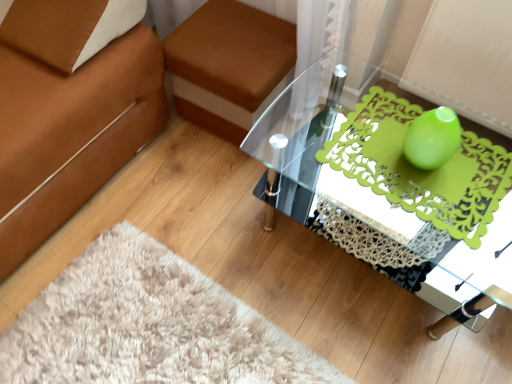
Question: Does brown fabric footrest at upper center lie in front of transparent glass table at center?

Choices:
 (A) no
 (B) yes

Answer: (A)

Question: Is the position of brown fabric footrest at upper center more distant than that of transparent glass table at center?

Choices:
 (A) no
 (B) yes

Answer: (B)

Question: From a real-world perspective, is brown fabric footrest at upper center beneath transparent glass table at center?

Choices:
 (A) yes
 (B) no

Answer: (A)

Question: Considering the relative sizes of brown fabric footrest at upper center and transparent glass table at center in the image provided, is brown fabric footrest at upper center bigger than transparent glass table at center?

Choices:
 (A) no
 (B) yes

Answer: (A)

Question: Does brown fabric footrest at upper center have a lesser height compared to transparent glass table at center?

Choices:
 (A) no
 (B) yes

Answer: (B)

Question: Based on their positions, is brown fabric footrest at upper center located to the left or right of transparent glass table at center?

Choices:
 (A) right
 (B) left

Answer: (B)

Question: Is point (290, 26) positioned closer to the camera than point (400, 256)?

Choices:
 (A) closer
 (B) farther

Answer: (B)

Question: Which is correct: brown fabric footrest at upper center is inside transparent glass table at center, or outside of it?

Choices:
 (A) inside
 (B) outside

Answer: (B)

Question: Is brown fabric footrest at upper center bigger or smaller than transparent glass table at center?

Choices:
 (A) small
 (B) big

Answer: (A)

Question: Is teal glass vase at center in front of or behind green matte vase at upper right in the image?

Choices:
 (A) front
 (B) behind

Answer: (A)

Question: Is teal glass vase at center inside the boundaries of green matte vase at upper right, or outside?

Choices:
 (A) outside
 (B) inside

Answer: (A)

Question: Is point (428, 153) positioned closer to the camera than point (410, 185)?

Choices:
 (A) closer
 (B) farther

Answer: (A)

Question: Considering the positions of teal glass vase at center and green matte vase at upper right in the image, is teal glass vase at center bigger or smaller than green matte vase at upper right?

Choices:
 (A) big
 (B) small

Answer: (B)

Question: From a real-world perspective, is green matte vase at upper right positioned above or below brown fabric footrest at upper center?

Choices:
 (A) above
 (B) below

Answer: (A)

Question: In the image, is green matte vase at upper right on the left side or the right side of brown fabric footrest at upper center?

Choices:
 (A) right
 (B) left

Answer: (A)